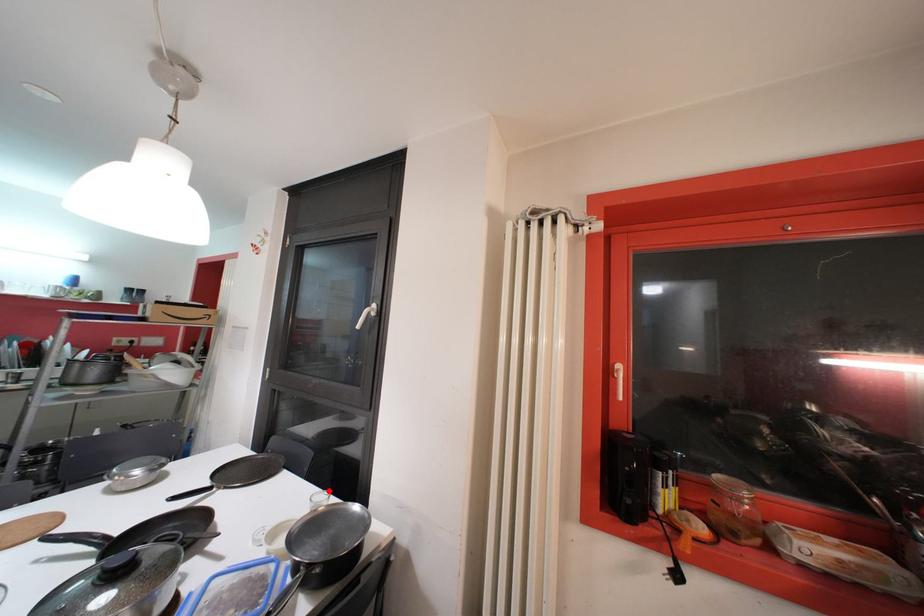
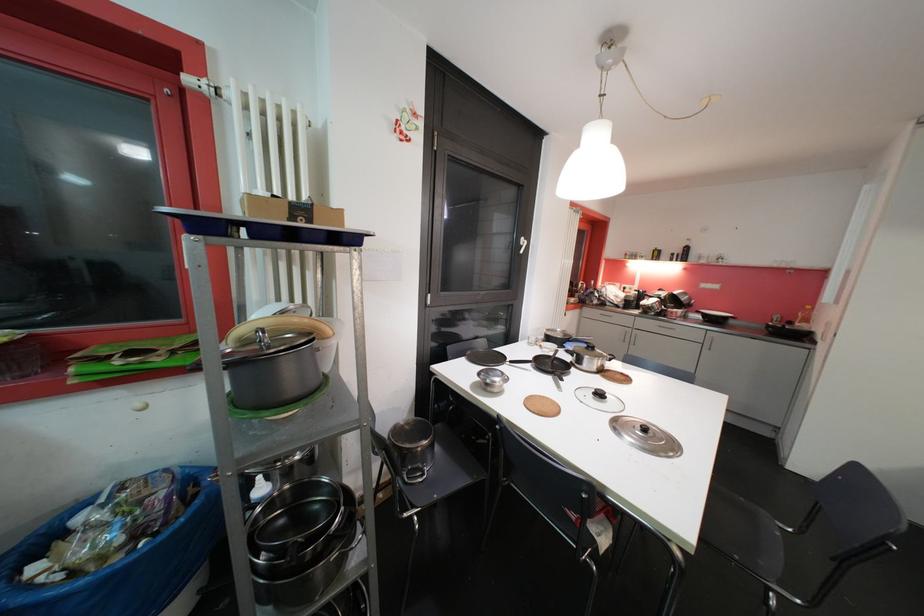
Question: I am providing you with two images of the same scene from different viewpoints. A red point is marked on the first image. Can you still see the location of the red point in image 2?

Choices:
 (A) Yes
 (B) No

Answer: (B)